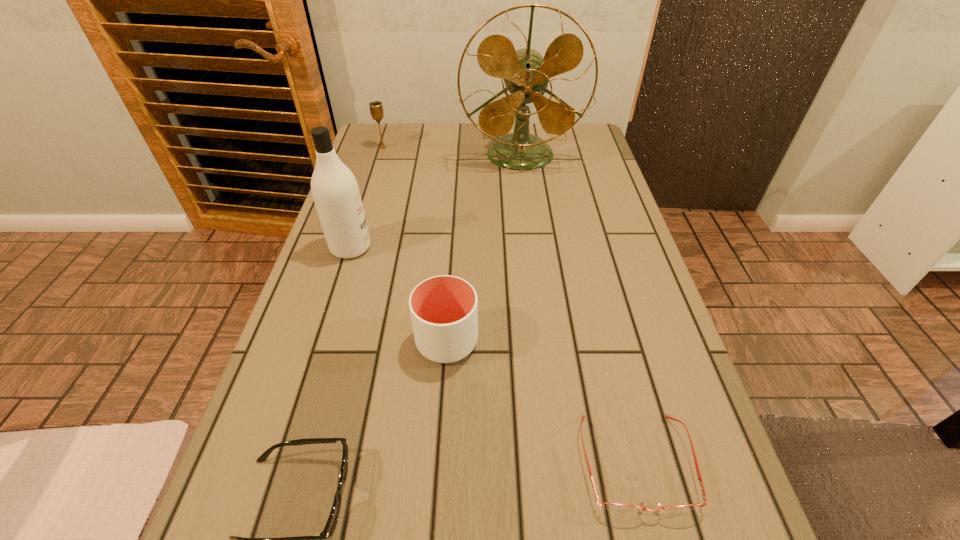
This screenshot has height=540, width=960. What are the coordinates of `object that is the fourth closest to the fourth tallest object` in the screenshot? It's located at (526, 73).

At what (x,y) coordinates should I click in order to perform the action: click on the fifth closest object relative to the fan. Please return your answer as a coordinate pair (x, y). Looking at the image, I should click on (319, 539).

The height and width of the screenshot is (540, 960). I want to click on free location that satisfies the following two spatial constraints: 1. on the back side of the fourth tallest object; 2. on the front-facing side of the shampoo, so click(x=453, y=247).

Where is `free spot that satisfies the following two spatial constraints: 1. on the front-facing side of the cup; 2. on the left side of the fourth nearest object`? Image resolution: width=960 pixels, height=540 pixels. free spot that satisfies the following two spatial constraints: 1. on the front-facing side of the cup; 2. on the left side of the fourth nearest object is located at coordinates pos(322,341).

Where is `vacant region that satisfies the following two spatial constraints: 1. on the front-facing side of the shampoo; 2. on the right side of the fourth farthest object`? This screenshot has height=540, width=960. vacant region that satisfies the following two spatial constraints: 1. on the front-facing side of the shampoo; 2. on the right side of the fourth farthest object is located at coordinates (322, 341).

In order to click on vacant space that satisfies the following two spatial constraints: 1. on the front-facing side of the third shortest object; 2. on the left side of the second tallest object in this screenshot , I will do `click(322, 341)`.